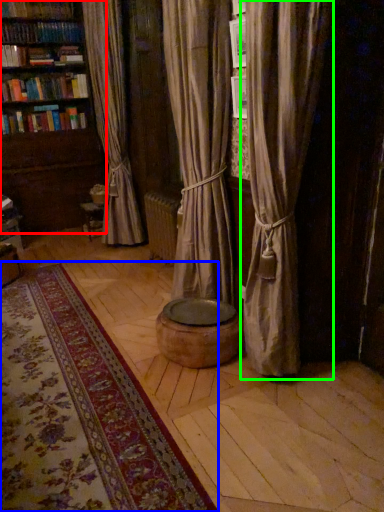
Question: Estimate the real-world distances between objects in this image. Which object is farther from bookcase (highlighted by a red box), mat (highlighted by a blue box) or curtain (highlighted by a green box)?

Choices:
 (A) mat
 (B) curtain

Answer: (B)